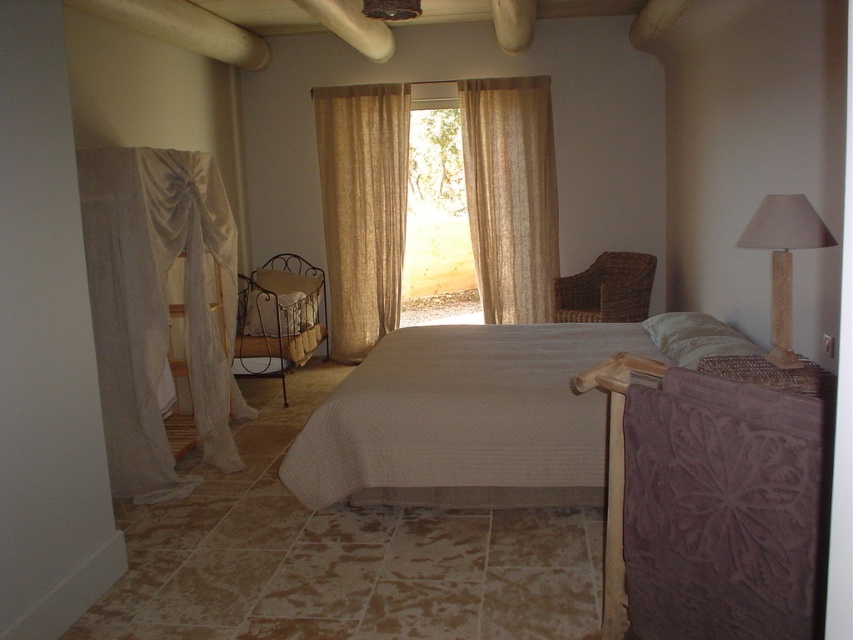
You are an interior designer planning to place a new decorative item in the bedroom. You have a small decorative item that needs to fit between the translucent beige curtains at center and the beige fabric lampshade at right. Considering their sizes, which object should you place the item next to to ensure it doesn

The translucent beige curtains at center are larger than the beige fabric lampshade at right, so placing the small decorative item next to the beige fabric lampshade at right would leave enough space for it to fit comfortably.